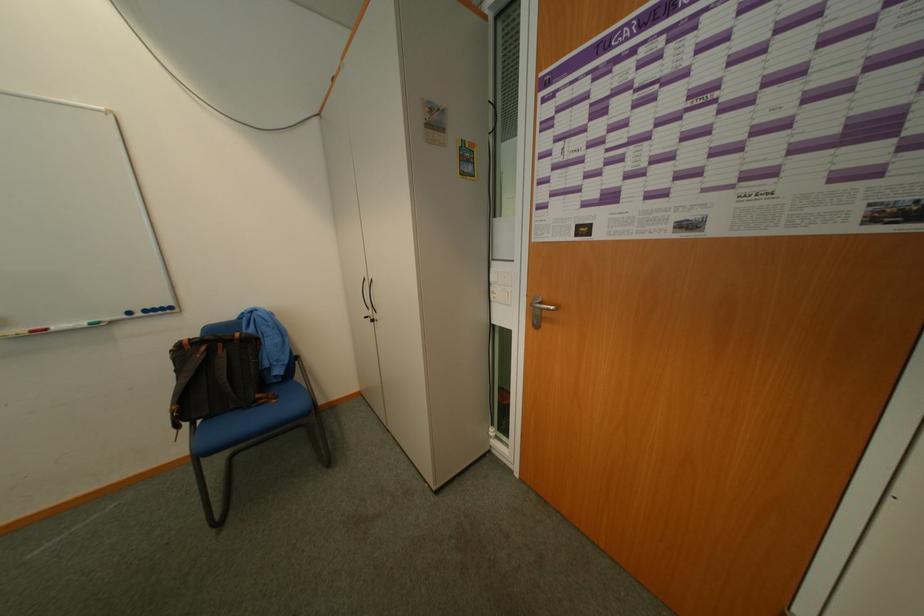
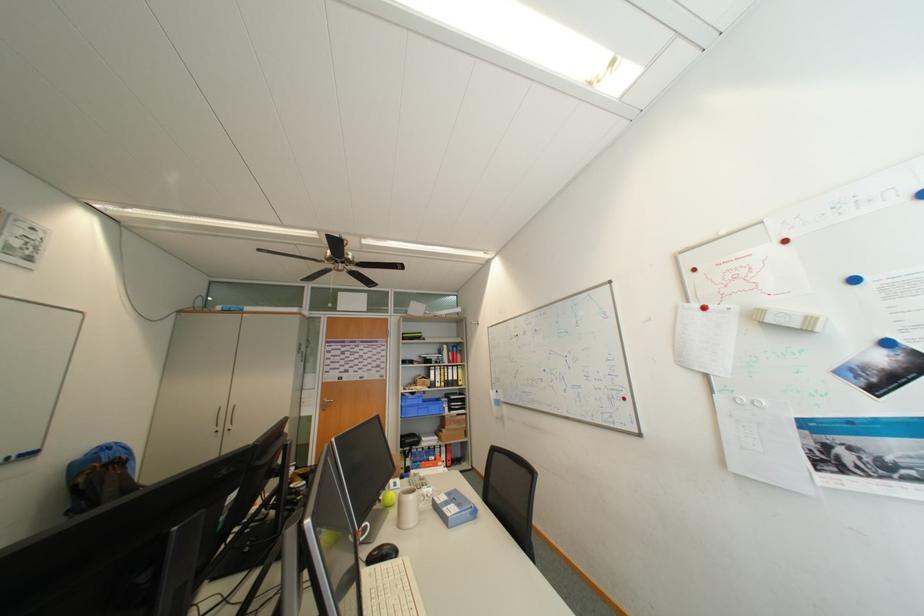
The point at (379, 315) is marked in the first image. Where is the corresponding point in the second image?

(229, 429)